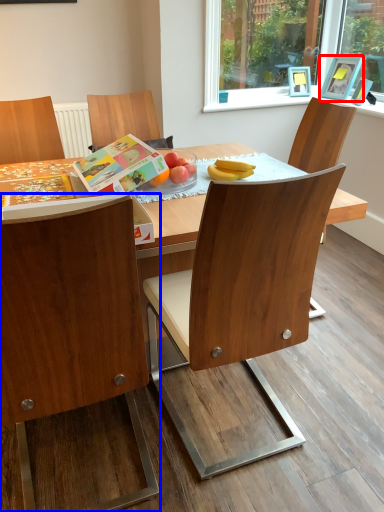
Question: Which of the following is the closest to the observer, picture frame (highlighted by a red box) or chair (highlighted by a blue box)?

Choices:
 (A) picture frame
 (B) chair

Answer: (B)